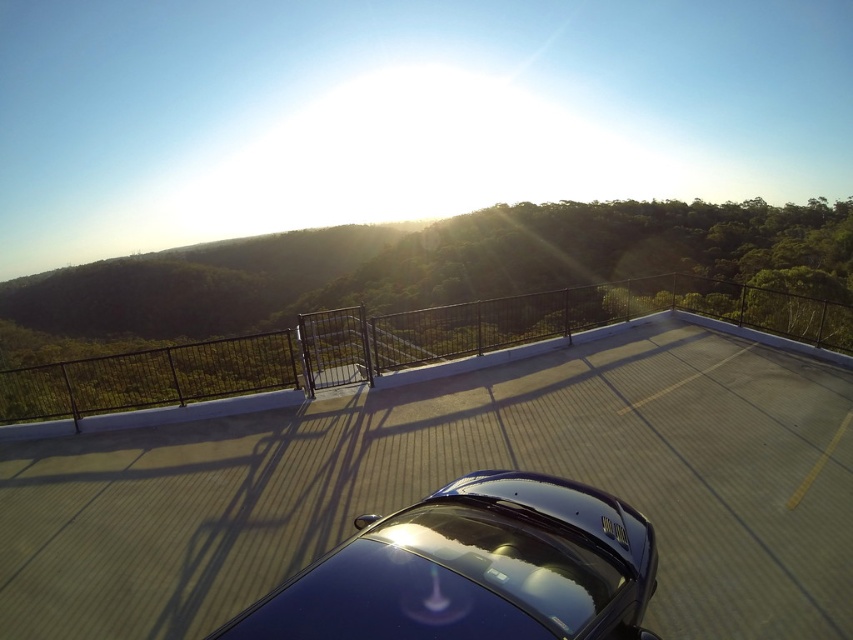
Based on the photo, between glossy asphalt highway at center and glossy blue car at center, which one has more height?

Standing taller between the two is glossy asphalt highway at center.

Who is lower down, glossy asphalt highway at center or glossy blue car at center?

Positioned lower is glossy asphalt highway at center.

Does point (555, 397) come farther from viewer compared to point (450, 493)?

Yes, it is behind point (450, 493).

Find the location of a particular element. glossy asphalt highway at center is located at coordinates pyautogui.click(x=451, y=477).